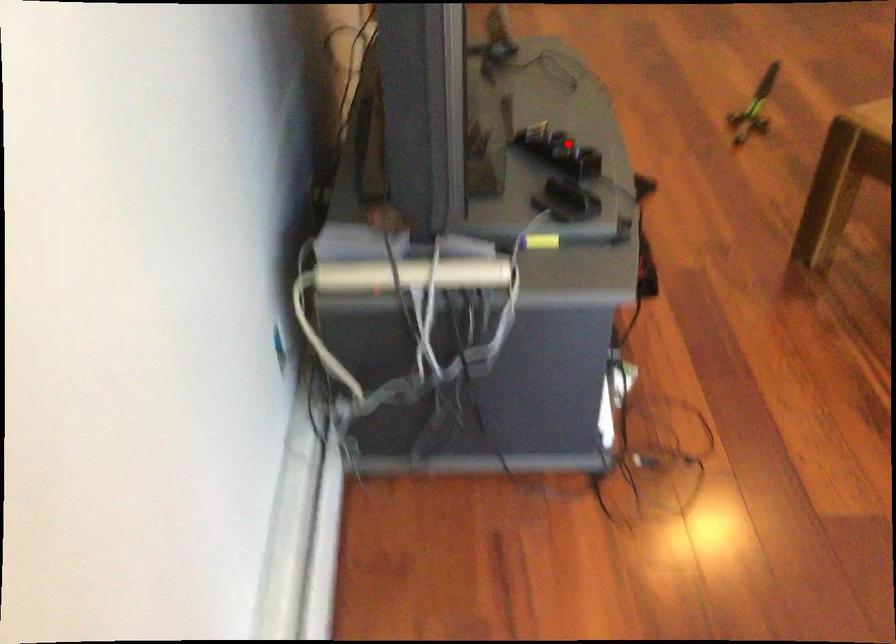
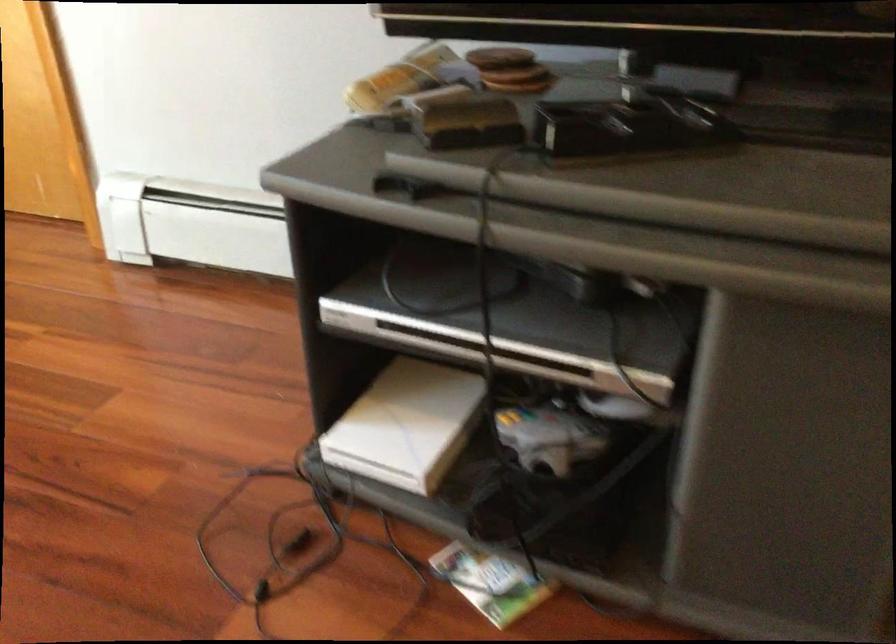
The point at the highlighted location is marked in the first image. Where is the corresponding point in the second image?

(627, 126)